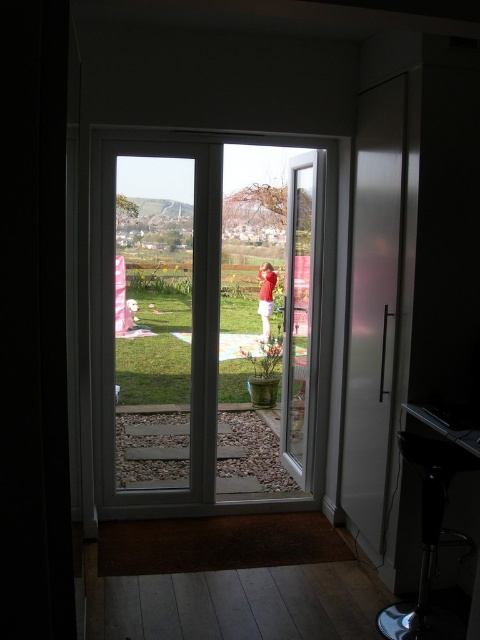
Question: Which of the following is the farthest from the observer?

Choices:
 (A) (300, 192)
 (B) (385, 209)

Answer: (A)

Question: From the image, what is the correct spatial relationship of transparent glass door at center in relation to frosted glass screen door at right?

Choices:
 (A) above
 (B) below

Answer: (A)

Question: Is transparent glass door at center bigger than frosted glass screen door at right?

Choices:
 (A) yes
 (B) no

Answer: (A)

Question: Does transparent glass door at center have a lesser width compared to frosted glass screen door at right?

Choices:
 (A) yes
 (B) no

Answer: (B)

Question: Which point is closer to the camera?

Choices:
 (A) transparent glass door at center
 (B) frosted glass screen door at right

Answer: (B)